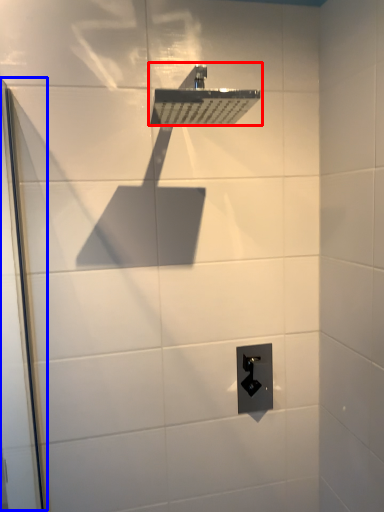
Question: Which point is further to the camera, shower (highlighted by a red box) or screen door (highlighted by a blue box)?

Choices:
 (A) shower
 (B) screen door

Answer: (A)